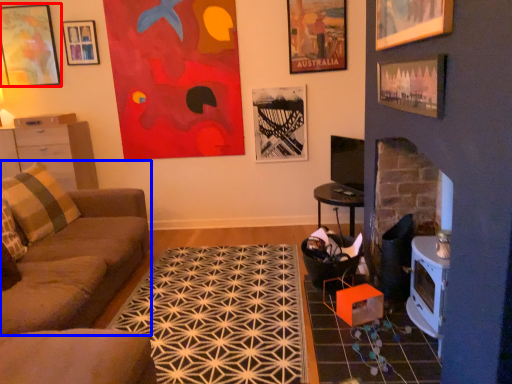
Question: Among these objects, which one is farthest to the camera, picture frame (highlighted by a red box) or studio couch (highlighted by a blue box)?

Choices:
 (A) picture frame
 (B) studio couch

Answer: (A)